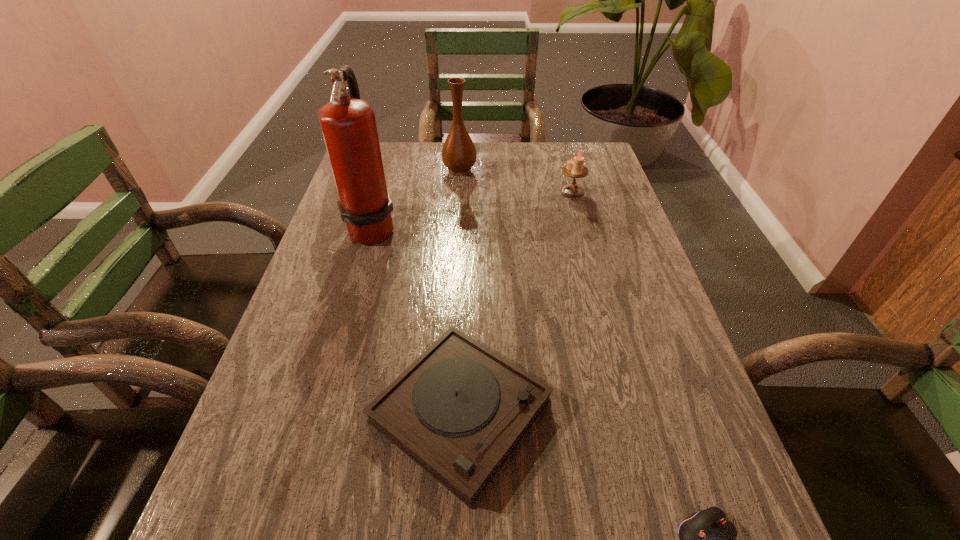
I want to click on the third nearest object, so click(348, 124).

Find the location of a particular element. the tallest object is located at coordinates (348, 124).

The width and height of the screenshot is (960, 540). What are the coordinates of `the farthest object` in the screenshot? It's located at (459, 154).

Where is `the fourth shortest object`? the fourth shortest object is located at coordinates (459, 154).

Image resolution: width=960 pixels, height=540 pixels. Find the location of `candle holder`. candle holder is located at coordinates (574, 168).

You are a GUI agent. You are given a task and a screenshot of the screen. Output one action in this format:
    pyautogui.click(x=<x>, y=<y>)
    Task: Click on the second farthest object
    
    Given the screenshot: What is the action you would take?
    pyautogui.click(x=574, y=168)

Find the location of a particular element. the fourth farthest object is located at coordinates (459, 410).

The image size is (960, 540). I want to click on the fourth tallest object, so click(459, 410).

This screenshot has height=540, width=960. I want to click on free location located 0.370m at the nozzle of the leftmost object, so click(x=529, y=227).

Image resolution: width=960 pixels, height=540 pixels. What are the coordinates of `free space located on the front of the farthest object` in the screenshot? It's located at (456, 222).